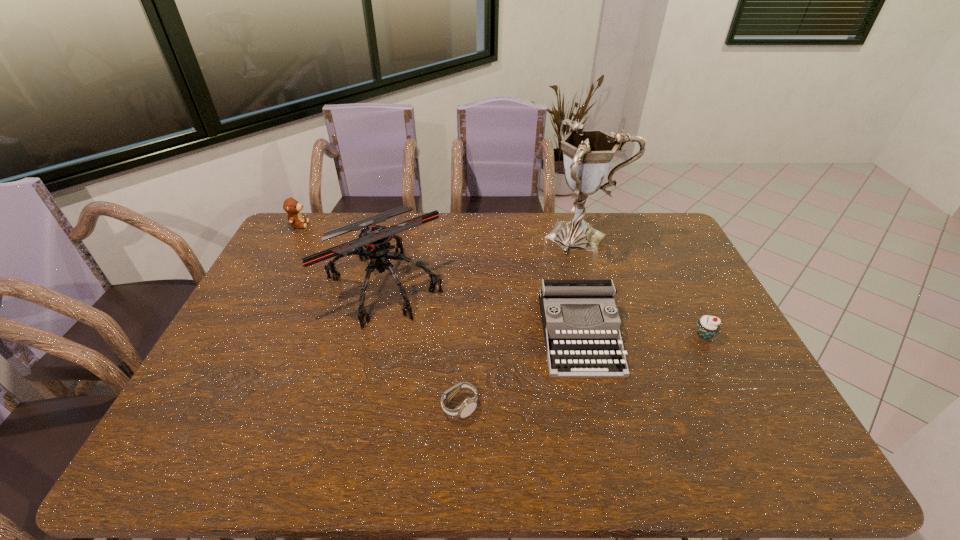
Identify the location of empty space that is in between the rightmost object and the trophy cup. (644, 285).

Where is `vacant area that lies between the typewriter and the drone`? vacant area that lies between the typewriter and the drone is located at coordinates (482, 309).

Locate an element on the screen. blank region between the typewriter and the watch is located at coordinates (519, 370).

Select which object appears as the second closest to the cupcake. Please provide its 2D coordinates. Your answer should be formatted as a tuple, i.e. [(x, y)], where the tuple contains the x and y coordinates of a point satisfying the conditions above.

[(588, 154)]

Identify which object is located as the third nearest to the watch. Please provide its 2D coordinates. Your answer should be formatted as a tuple, i.e. [(x, y)], where the tuple contains the x and y coordinates of a point satisfying the conditions above.

[(588, 154)]

The width and height of the screenshot is (960, 540). Identify the location of vacant space that satisfies the following two spatial constraints: 1. on the typing side of the typewriter; 2. on the face of the nearest object. (595, 406).

Locate an element on the screen. The image size is (960, 540). vacant point that satisfies the following two spatial constraints: 1. on the face of the second object from left to right; 2. on the left side of the leftmost object is located at coordinates (267, 285).

Identify the location of free spot that satisfies the following two spatial constraints: 1. on the back side of the tallest object; 2. on the face of the teddy bear. The image size is (960, 540). (581, 225).

You are a GUI agent. You are given a task and a screenshot of the screen. Output one action in this format:
    pyautogui.click(x=<x>, y=<y>)
    Task: Click on the free spot that satisfies the following two spatial constraints: 1. on the typing side of the typewriter; 2. on the right side of the rightmost object
    The width and height of the screenshot is (960, 540).
    Given the screenshot: What is the action you would take?
    pyautogui.click(x=580, y=335)

What are the coordinates of `vacant position in the image that satisfies the following two spatial constraints: 1. on the typing side of the typewriter; 2. on the right side of the cupcake` in the screenshot? It's located at (580, 335).